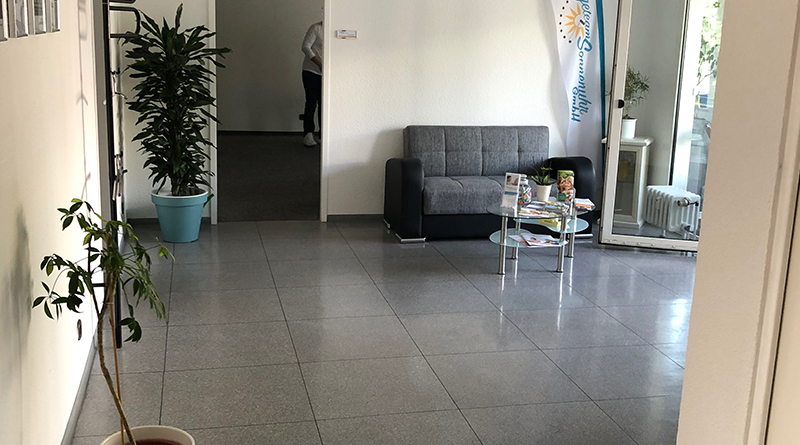
I want to click on floor, so click(378, 323).